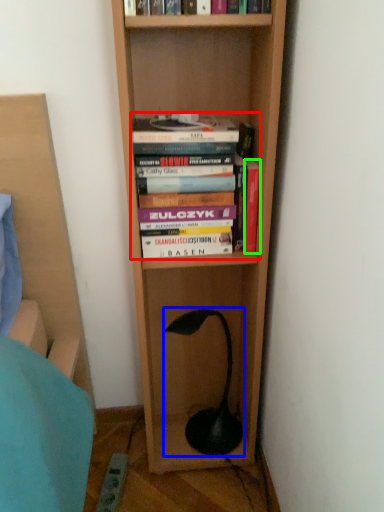
Question: Which object is positioned closest to book (highlighted by a red box)? Select from lamp (highlighted by a blue box) and book (highlighted by a green box).

Choices:
 (A) lamp
 (B) book

Answer: (B)